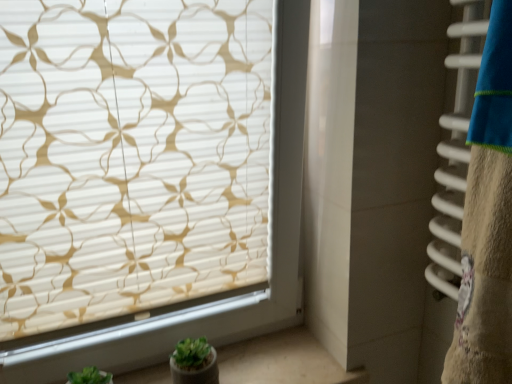
At what (x,y) coordinates should I click in order to perform the action: click on white textured blind at upper left. Please return your answer as a coordinate pair (x, y). Looking at the image, I should click on (130, 156).

Describe the element at coordinates (130, 156) in the screenshot. Image resolution: width=512 pixels, height=384 pixels. I see `white textured blind at upper left` at that location.

Describe the element at coordinates (283, 360) in the screenshot. This screenshot has height=384, width=512. I see `white smooth window sill at lower left` at that location.

Measure the distance between white smooth window sill at lower left and camera.

A distance of 38.58 inches exists between white smooth window sill at lower left and camera.

Locate an element on the screen. white smooth window sill at lower left is located at coordinates (283, 360).

Measure the distance between point (288, 355) and camera.

1.05 meters.

Find the location of a particular element. white textured blind at upper left is located at coordinates (130, 156).

Considering the relative positions of white textured blind at upper left and white smooth window sill at lower left in the image provided, is white textured blind at upper left to the left or to the right of white smooth window sill at lower left?

Based on their positions, white textured blind at upper left is located to the left of white smooth window sill at lower left.

Which is behind, white textured blind at upper left or white smooth window sill at lower left?

white smooth window sill at lower left is further from the camera.

Which is closer to the camera, (231, 125) or (334, 376)?

Point (231, 125) appears to be closer to the viewer than point (334, 376).

From the image's perspective, which is below, white textured blind at upper left or white smooth window sill at lower left?

white smooth window sill at lower left.

From a real-world perspective, between white textured blind at upper left and white smooth window sill at lower left, who is vertically lower?

white smooth window sill at lower left is physically lower.

In terms of width, does white textured blind at upper left look wider or thinner when compared to white smooth window sill at lower left?

white textured blind at upper left is thinner than white smooth window sill at lower left.

Can you confirm if white textured blind at upper left is taller than white smooth window sill at lower left?

Yes, white textured blind at upper left is taller than white smooth window sill at lower left.

Considering the sizes of objects white textured blind at upper left and white smooth window sill at lower left in the image provided, who is bigger, white textured blind at upper left or white smooth window sill at lower left?

white textured blind at upper left.

Is white smooth window sill at lower left located within white textured blind at upper left?

That's incorrect, white smooth window sill at lower left is not inside white textured blind at upper left.

Based on the photo, are white textured blind at upper left and white smooth window sill at lower left beside each other?

white textured blind at upper left is not next to white smooth window sill at lower left, and they're not touching.

Could you tell me if white textured blind at upper left is facing white smooth window sill at lower left?

No, white textured blind at upper left does not turn towards white smooth window sill at lower left.

Can you tell me how much white textured blind at upper left and white smooth window sill at lower left differ in facing direction?

They differ by 0.00706 degrees in their facing directions.

The image size is (512, 384). Identify the location of window blind positioned vertically above the white smooth window sill at lower left (from a real-world perspective). (130, 156).

Can you confirm if white smooth window sill at lower left is positioned to the left of white textured blind at upper left?

In fact, white smooth window sill at lower left is to the right of white textured blind at upper left.

Considering the relative positions of white smooth window sill at lower left and white textured blind at upper left in the image provided, is white smooth window sill at lower left in front of white textured blind at upper left?

No, it is not.

Is point (272, 355) closer or farther from the camera than point (179, 6)?

Point (272, 355) is positioned farther from the camera compared to point (179, 6).

From the image's perspective, is white smooth window sill at lower left located beneath white textured blind at upper left?

Yes, from the image's perspective, white smooth window sill at lower left is below white textured blind at upper left.

From a real-world perspective, which is physically below, white smooth window sill at lower left or white textured blind at upper left?

white smooth window sill at lower left.

Considering the sizes of objects white smooth window sill at lower left and white textured blind at upper left in the image provided, who is wider, white smooth window sill at lower left or white textured blind at upper left?

With larger width is white smooth window sill at lower left.

Which of these two, white smooth window sill at lower left or white textured blind at upper left, stands shorter?

white smooth window sill at lower left is shorter.

Can you confirm if white smooth window sill at lower left is smaller than white textured blind at upper left?

Yes, white smooth window sill at lower left is smaller than white textured blind at upper left.

Is white smooth window sill at lower left located outside white textured blind at upper left?

Absolutely, white smooth window sill at lower left is external to white textured blind at upper left.

Is white smooth window sill at lower left touching white textured blind at upper left?

white smooth window sill at lower left is not next to white textured blind at upper left, and they're not touching.

Is white smooth window sill at lower left aimed at white textured blind at upper left?

No, white smooth window sill at lower left is not oriented towards white textured blind at upper left.

Identify the location of window sill below the white textured blind at upper left (from the image's perspective). The image size is (512, 384). click(283, 360).

At what (x,y) coordinates should I click in order to perform the action: click on window blind on the left of white smooth window sill at lower left. Please return your answer as a coordinate pair (x, y). This screenshot has width=512, height=384. Looking at the image, I should click on (130, 156).

Image resolution: width=512 pixels, height=384 pixels. I want to click on window blind that is above the white smooth window sill at lower left (from a real-world perspective), so click(x=130, y=156).